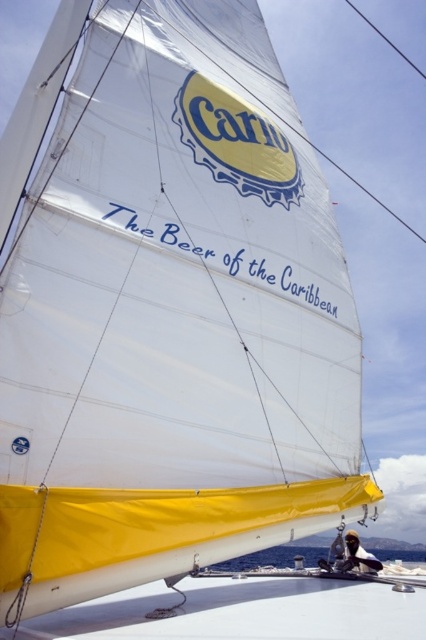
You are a photographer trying to capture the sailboat sail with both the transparent water at lower center and the smooth black hair at lower right in the frame. Based on their positions, which object should you adjust your camera to focus on first to ensure both are in the shot?

The transparent water at lower center is to the right of the smooth black hair at lower right, so you should focus on the smooth black hair at lower right first to ensure both objects are included in the frame.

You are a photographer trying to capture the sailboat sail with both the transparent water at lower center and the smooth black hair at lower right in the frame. Which object will occupy more horizontal space in your photo?

The transparent water at lower center will occupy more horizontal space because its width is larger than the smooth black hair at lower right.